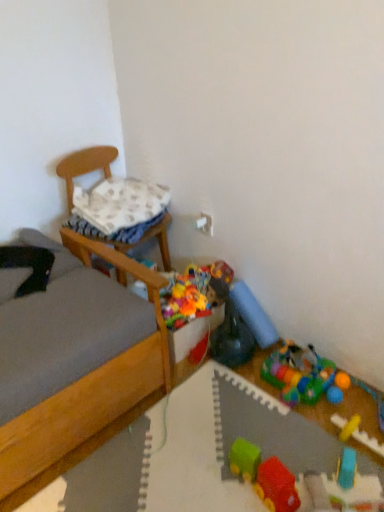
The width and height of the screenshot is (384, 512). I want to click on vacant point to the left of rubberized plastic train at center, the 1th toy in the front-to-back sequence, so click(208, 477).